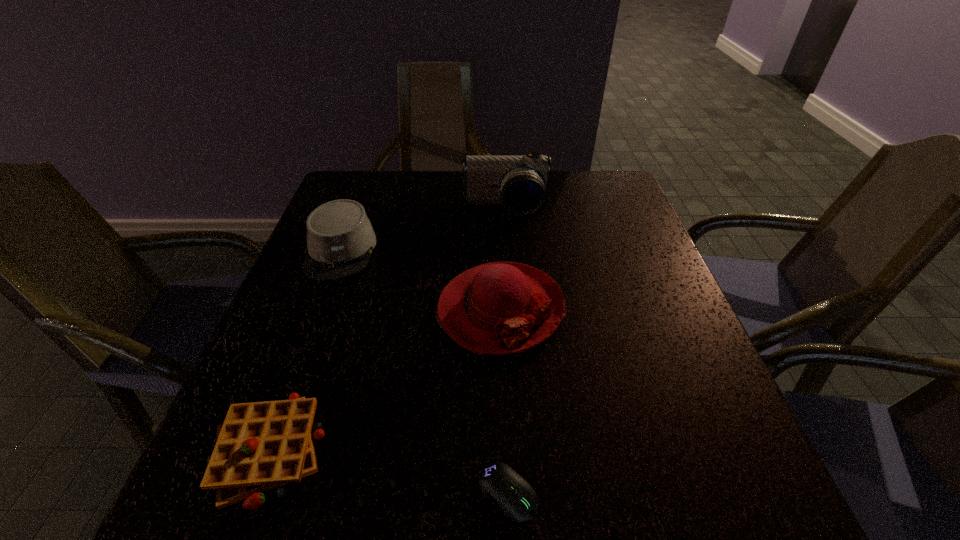
The image size is (960, 540). Identify the location of the tallest object. (521, 183).

This screenshot has height=540, width=960. In order to click on the farthest object in this screenshot , I will do `click(521, 183)`.

Locate an element on the screen. This screenshot has height=540, width=960. the second tallest object is located at coordinates (499, 308).

Where is `the right hat`? the right hat is located at coordinates (499, 308).

The width and height of the screenshot is (960, 540). What are the coordinates of `the shorter hat` in the screenshot? It's located at (340, 238).

Where is `the left hat`? the left hat is located at coordinates (340, 238).

Where is `waffle`? waffle is located at coordinates (260, 446).

Locate an element on the screen. This screenshot has height=540, width=960. the shortest object is located at coordinates (499, 482).

The image size is (960, 540). I want to click on free space located on the surface of the camcorder, so click(x=509, y=254).

You are a GUI agent. You are given a task and a screenshot of the screen. Output one action in this format:
    pyautogui.click(x=<x>, y=<y>)
    Task: Click on the vacant position located at the front of the fourth shortest object with a bow
    The height and width of the screenshot is (540, 960).
    Given the screenshot: What is the action you would take?
    pyautogui.click(x=509, y=500)